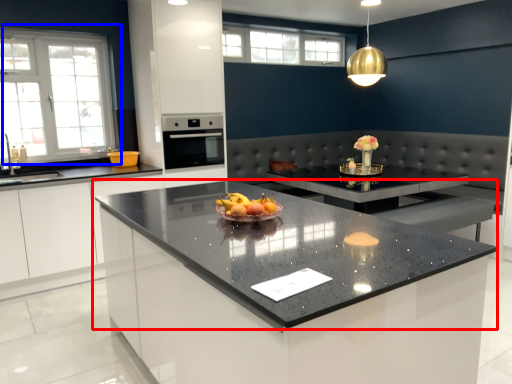
Question: Which point is closer to the camera, countertop (highlighted by a red box) or window (highlighted by a blue box)?

Choices:
 (A) countertop
 (B) window

Answer: (A)